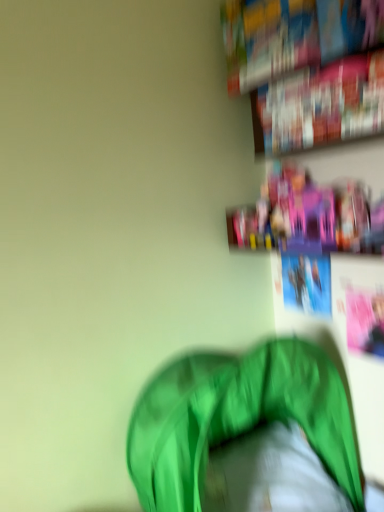
Question: Should I look upward or downward to see hardcover book at upper right, marked as the 2th book in a top-to-bottom arrangement?

Choices:
 (A) up
 (B) down

Answer: (A)

Question: Is pink plastic toys at upper right taller than hardcover book at upper right, the 1th book positioned from the bottom?

Choices:
 (A) no
 (B) yes

Answer: (A)

Question: Does pink plastic toys at upper right have a larger size compared to hardcover book at upper right, the 1th book positioned from the bottom?

Choices:
 (A) yes
 (B) no

Answer: (A)

Question: Is pink plastic toys at upper right wider than hardcover book at upper right, marked as the 2th book in a top-to-bottom arrangement?

Choices:
 (A) yes
 (B) no

Answer: (A)

Question: From a real-world perspective, does pink plastic toys at upper right stand above hardcover book at upper right, marked as the 2th book in a top-to-bottom arrangement?

Choices:
 (A) no
 (B) yes

Answer: (A)

Question: Could you tell me if pink plastic toys at upper right is turned towards hardcover book at upper right, marked as the 2th book in a top-to-bottom arrangement?

Choices:
 (A) yes
 (B) no

Answer: (B)

Question: Is pink plastic toys at upper right looking in the opposite direction of hardcover book at upper right, the 1th book positioned from the bottom?

Choices:
 (A) no
 (B) yes

Answer: (A)

Question: Considering the relative positions of hardcover book at upper right, placed as the 1th book when sorted from top to bottom, and green fabric bean bag at lower center in the image provided, is hardcover book at upper right, placed as the 1th book when sorted from top to bottom, behind green fabric bean bag at lower center?

Choices:
 (A) yes
 (B) no

Answer: (A)

Question: From the image's perspective, is hardcover book at upper right, which is the 2th book in bottom-to-top order, under green fabric bean bag at lower center?

Choices:
 (A) no
 (B) yes

Answer: (A)

Question: Does hardcover book at upper right, placed as the 1th book when sorted from top to bottom, come in front of green fabric bean bag at lower center?

Choices:
 (A) yes
 (B) no

Answer: (B)

Question: Is there a large distance between hardcover book at upper right, placed as the 1th book when sorted from top to bottom, and green fabric bean bag at lower center?

Choices:
 (A) no
 (B) yes

Answer: (B)

Question: Considering the relative sizes of hardcover book at upper right, which is the 2th book in bottom-to-top order, and green fabric bean bag at lower center in the image provided, is hardcover book at upper right, which is the 2th book in bottom-to-top order, shorter than green fabric bean bag at lower center?

Choices:
 (A) yes
 (B) no

Answer: (A)

Question: Does hardcover book at upper right, placed as the 1th book when sorted from top to bottom, turn towards green fabric bean bag at lower center?

Choices:
 (A) yes
 (B) no

Answer: (B)

Question: Does hardcover book at upper right, marked as the 2th book in a top-to-bottom arrangement, have a lesser height compared to pink plastic toys at upper right?

Choices:
 (A) no
 (B) yes

Answer: (A)